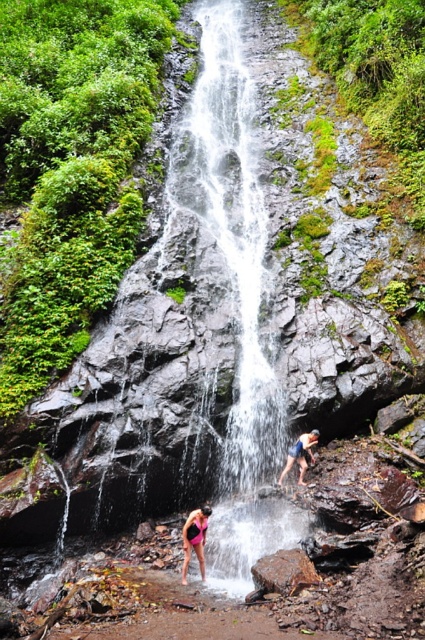
Can you confirm if white textured water at center is positioned above pink matte swimsuit at lower center?

Yes.

Find the location of a particular element. The width and height of the screenshot is (425, 640). white textured water at center is located at coordinates (234, 291).

Locate an element on the screen. Image resolution: width=425 pixels, height=640 pixels. white textured water at center is located at coordinates (234, 291).

Can you confirm if brown rough rock at center is positioned to the left of pink matte swimsuit at lower center?

Incorrect, brown rough rock at center is not on the left side of pink matte swimsuit at lower center.

Does point (295, 570) come farther from viewer compared to point (183, 564)?

No, (295, 570) is in front of (183, 564).

You are a GUI agent. You are given a task and a screenshot of the screen. Output one action in this format:
    pyautogui.click(x=<x>, y=<y>)
    Task: Click on the brown rough rock at center
    
    Given the screenshot: What is the action you would take?
    pyautogui.click(x=285, y=572)

Between white textured water at center and brown rough rock at center, which one is positioned higher?

white textured water at center is higher up.

Is white textured water at center to the left of brown rough rock at center from the viewer's perspective?

Correct, you'll find white textured water at center to the left of brown rough rock at center.

Locate an element on the screen. The width and height of the screenshot is (425, 640). white textured water at center is located at coordinates 234,291.